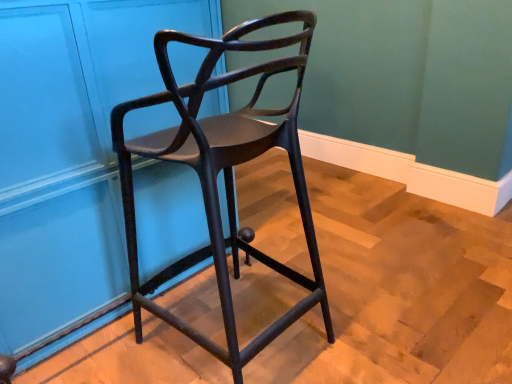
At what (x,y) coordinates should I click in order to perform the action: click on vacant area located to the right-hand side of matte blue door at upper left. Please return your answer as a coordinate pair (x, y). This screenshot has height=384, width=512. Looking at the image, I should click on (351, 252).